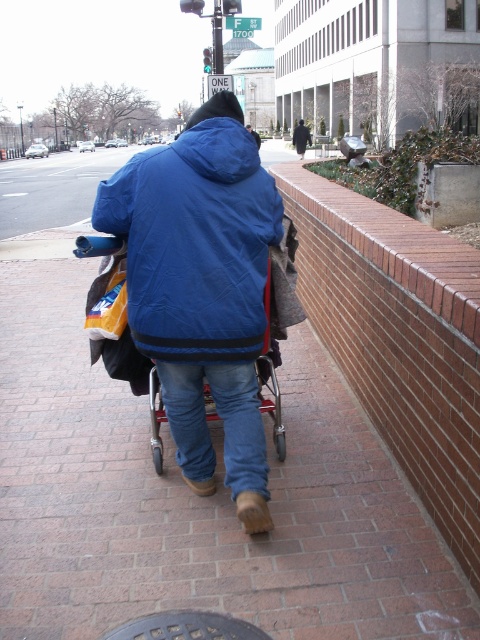
Question: Does dark brown leather jacket at center lie in front of blue fleece jacket at center?

Choices:
 (A) no
 (B) yes

Answer: (A)

Question: Is dark gray metallic manhole cover at lower center positioned in front of dark brown leather jacket at center?

Choices:
 (A) yes
 (B) no

Answer: (A)

Question: Which is nearer to the dark brown leather jacket at center?

Choices:
 (A) matte blue jacket at center
 (B) dark gray metallic manhole cover at lower center
 (C) blue fleece jacket at center

Answer: (C)

Question: Which point is farther from the camera taking this photo?

Choices:
 (A) (249, 131)
 (B) (255, 243)
 (C) (171, 614)

Answer: (A)

Question: Which point is closer to the camera taking this photo?

Choices:
 (A) (256, 145)
 (B) (305, 134)

Answer: (A)

Question: Is dark brown leather jacket at center above blue fleece jacket at center?

Choices:
 (A) yes
 (B) no

Answer: (B)